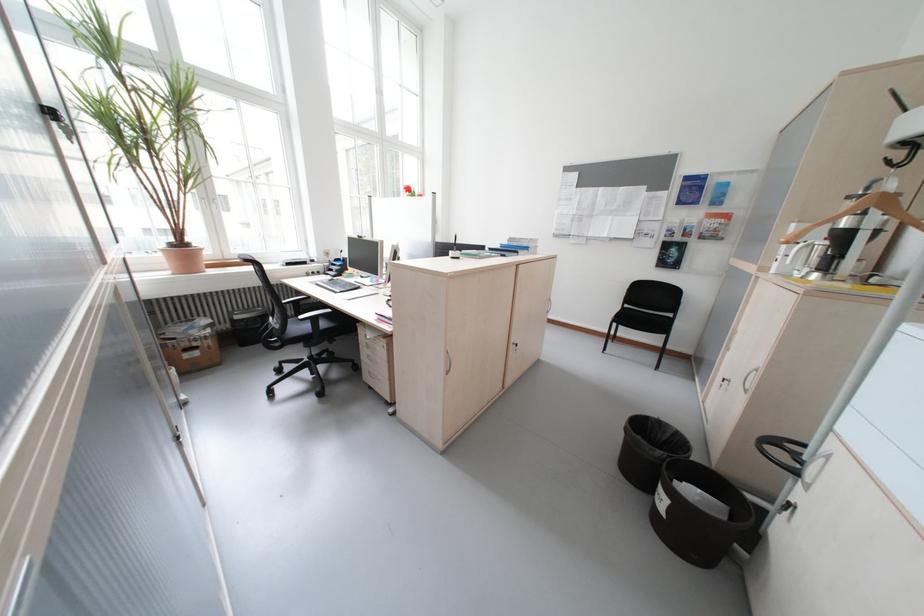
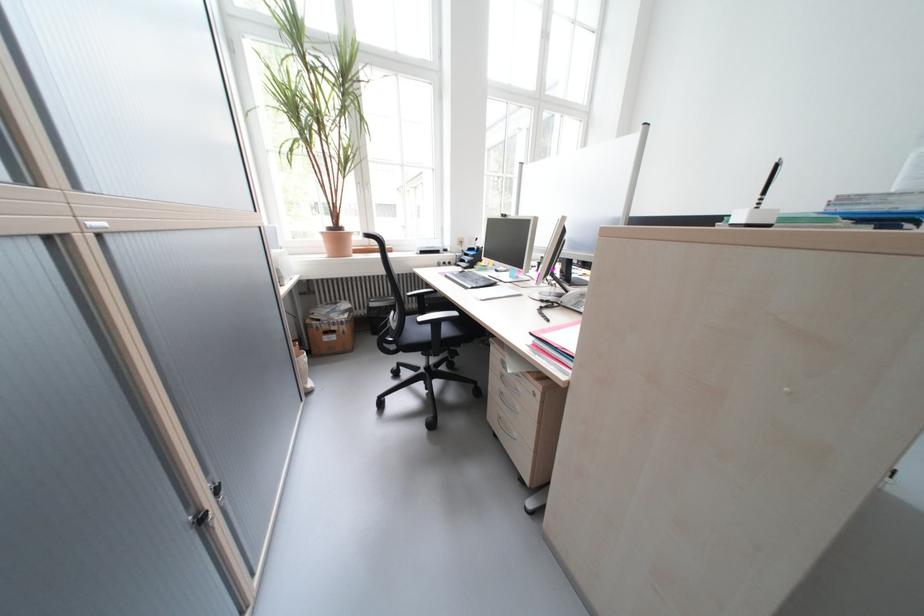
Where in the second image is the point corresponding to (x=207, y=355) from the first image?

(344, 339)